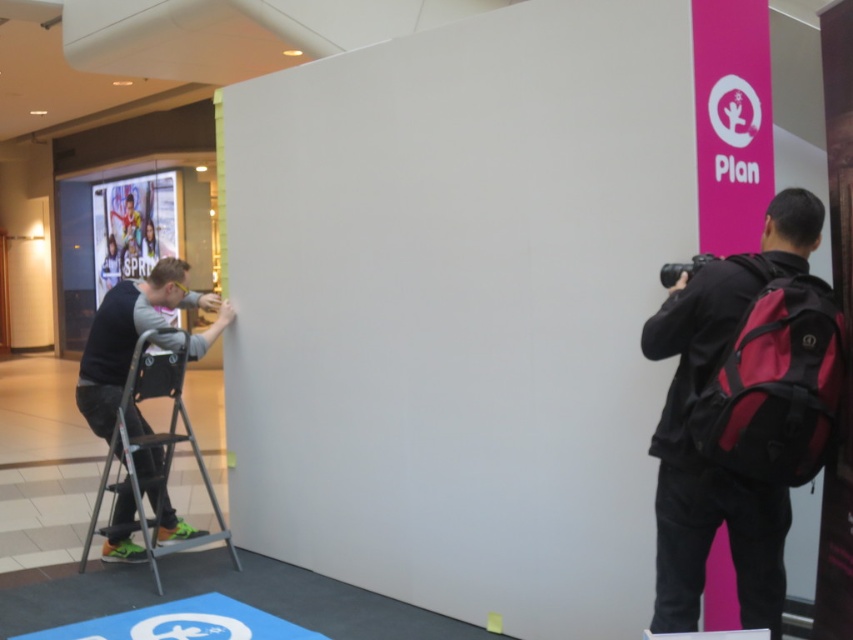
Who is lower down, black backpack at right or metallic silver ladder at left?

Positioned lower is metallic silver ladder at left.

Can you confirm if black backpack at right is smaller than metallic silver ladder at left?

Indeed, black backpack at right has a smaller size compared to metallic silver ladder at left.

Is point (773, 346) closer to camera compared to point (187, 442)?

Yes, point (773, 346) is in front of point (187, 442).

This screenshot has height=640, width=853. Identify the location of black backpack at right. (741, 412).